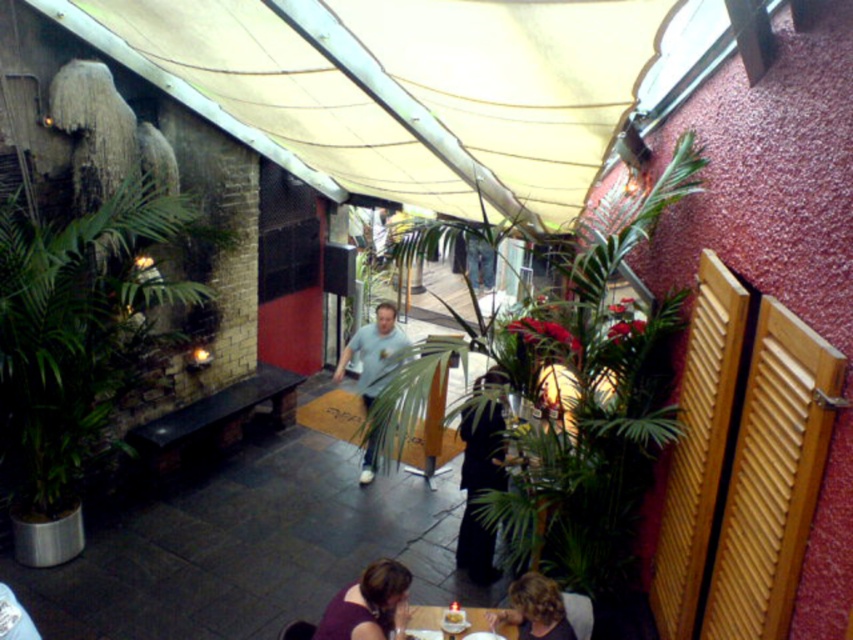
You are standing at the point closest to the brick wall in the outdoor seating area. There are two points marked in the scene, one at coordinates point (151, 184) and another at point (514, 634). Which of these points is farther away from you?

The point at coordinates point (514, 634) is farther away from you because point (151, 184) is behind point (514, 634), meaning it is closer to the brick wall where you are standing.

You are a photographer setting up for an outdoor event at this restaurant. You notice the purple matte dress at lower center and the blonde hair at lower center. Which object is covering the other one?

The purple matte dress at lower center is positioned over blonde hair at lower center, so the dress is covering the hair.